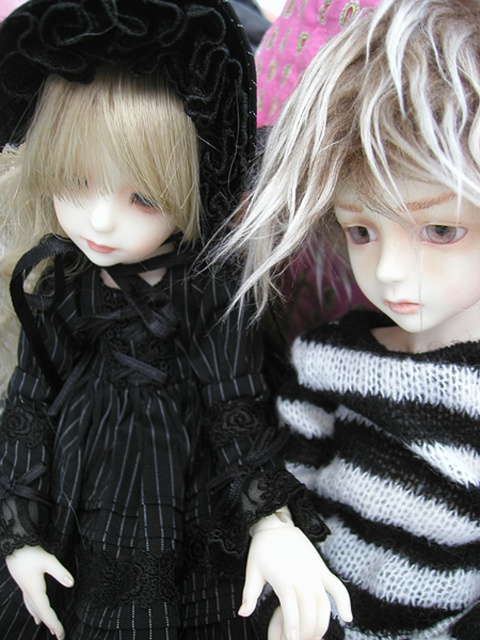
Question: Which point is farther to the camera?

Choices:
 (A) (134, 435)
 (B) (292, 449)

Answer: (A)

Question: Is matte black dress at left above black pinstriped dress at center?

Choices:
 (A) yes
 (B) no

Answer: (B)

Question: Does matte black dress at left have a greater width compared to black pinstriped dress at center?

Choices:
 (A) yes
 (B) no

Answer: (A)

Question: Which point is closer to the camera taking this photo?

Choices:
 (A) (312, 364)
 (B) (137, 100)

Answer: (B)

Question: Which point is farther to the camera?

Choices:
 (A) matte black dress at left
 (B) black pinstriped dress at center

Answer: (A)

Question: Can you confirm if matte black dress at left is wider than black pinstriped dress at center?

Choices:
 (A) yes
 (B) no

Answer: (A)